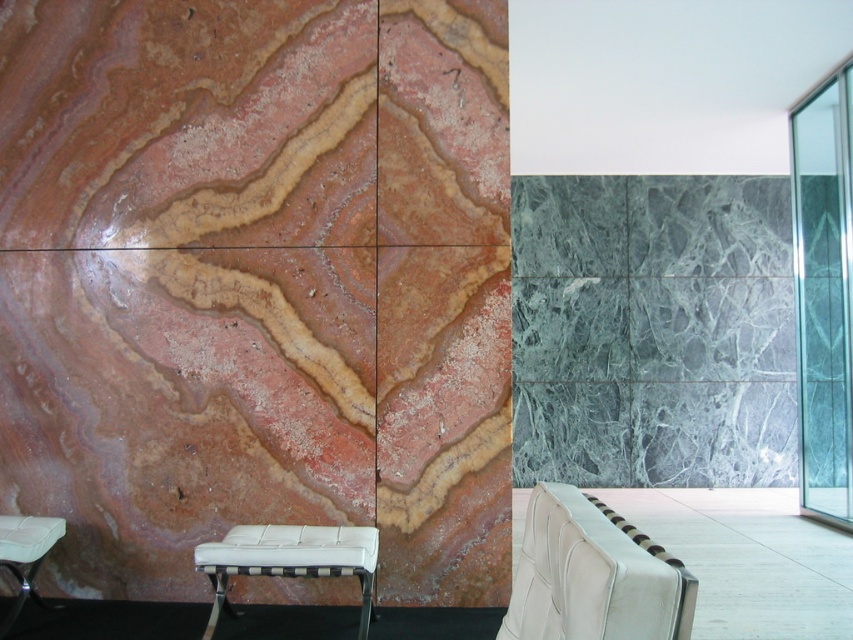
In the scene shown: Does white leather bench at lower center have a smaller size compared to white leather stool at lower left?

No, white leather bench at lower center is not smaller than white leather stool at lower left.

Who is more distant from viewer, (x=288, y=525) or (x=44, y=554)?

The point (x=288, y=525) is more distant.

Where is `white leather bench at lower center`? white leather bench at lower center is located at coordinates (289, 561).

Does transparent glass door at right lie in front of white leather stool at lower left?

No, it is not.

Is the position of transparent glass door at right more distant than that of white leather stool at lower left?

Yes, transparent glass door at right is further from the viewer.

Which is behind, point (799, 342) or point (10, 516)?

The point (799, 342) is more distant.

Image resolution: width=853 pixels, height=640 pixels. What are the coordinates of `transparent glass door at right` in the screenshot? It's located at (824, 292).

Between marble textured wall at left and white leather stool at lower left, which one has more height?

With more height is marble textured wall at left.

Can you confirm if marble textured wall at left is shorter than white leather stool at lower left?

In fact, marble textured wall at left may be taller than white leather stool at lower left.

Which is behind, point (442, 403) or point (0, 540)?

The point (442, 403) is behind.

In order to click on marble textured wall at left in this screenshot , I will do `click(256, 284)`.